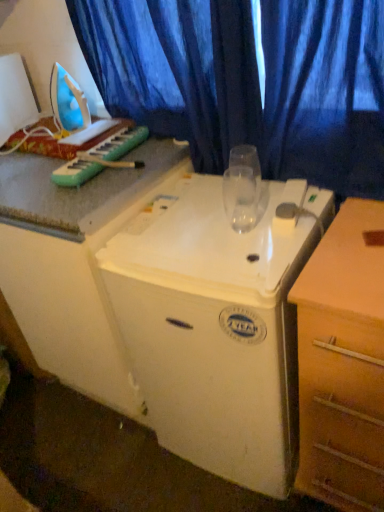
Find the location of a particular element. Image resolution: width=384 pixels, height=512 pixels. free space in front of transparent glass at center is located at coordinates (250, 253).